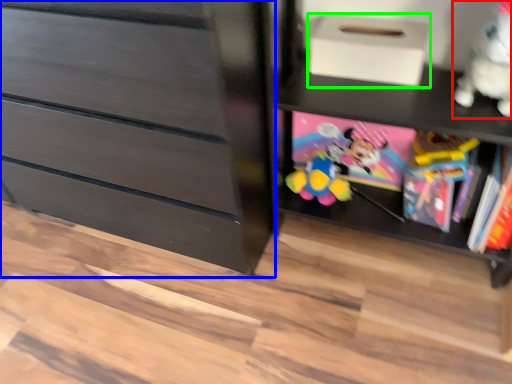
Question: Which object is positioned closest to toy (highlighted by a red box)? Select from chest of drawers (highlighted by a blue box) and shoe box (highlighted by a green box).

Choices:
 (A) chest of drawers
 (B) shoe box

Answer: (B)